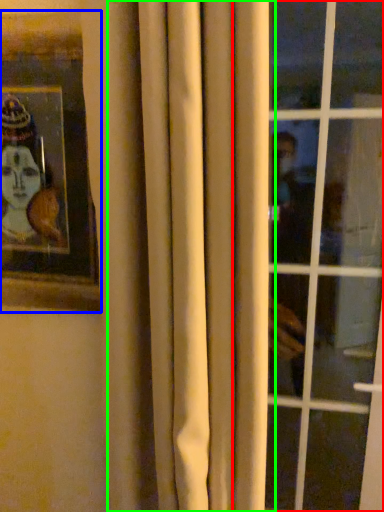
Question: Which object is positioned closest to window (highlighted by a red box)? Select from picture frame (highlighted by a blue box) and curtain (highlighted by a green box).

Choices:
 (A) picture frame
 (B) curtain

Answer: (B)